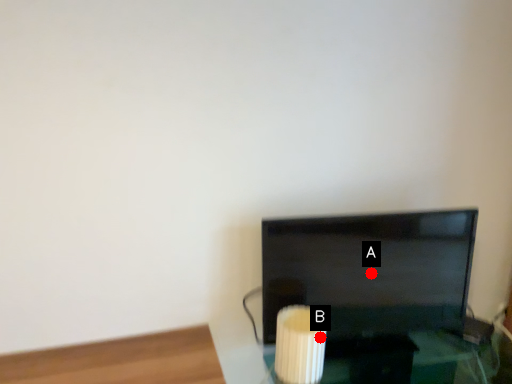
Question: Two points are circled on the image, labeled by A and B beside each circle. Which of the following is the farthest from the observer?

Choices:
 (A) A is further
 (B) B is further

Answer: (A)